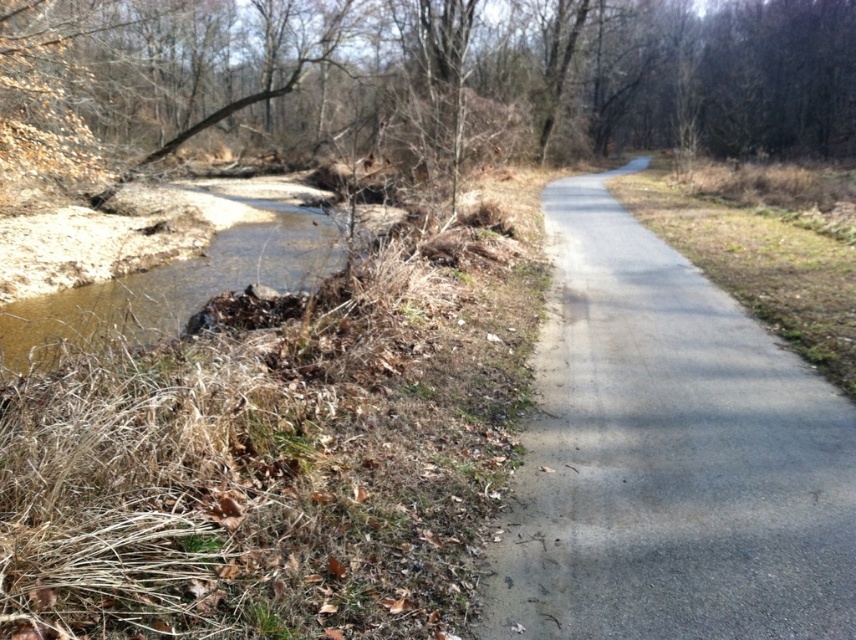
Question: Can you confirm if brown leafy tree at upper left is bigger than gray asphalt trail at center?

Choices:
 (A) no
 (B) yes

Answer: (B)

Question: Which point is farther to the camera?

Choices:
 (A) brown leafy tree at upper left
 (B) gray asphalt trail at center

Answer: (A)

Question: Is brown leafy tree at upper left to the right of gray asphalt trail at center from the viewer's perspective?

Choices:
 (A) yes
 (B) no

Answer: (B)

Question: Among these objects, which one is farthest from the camera?

Choices:
 (A) brown leafy tree at upper left
 (B) gray asphalt trail at center

Answer: (A)

Question: Is brown leafy tree at upper left positioned in front of gray asphalt trail at center?

Choices:
 (A) no
 (B) yes

Answer: (A)